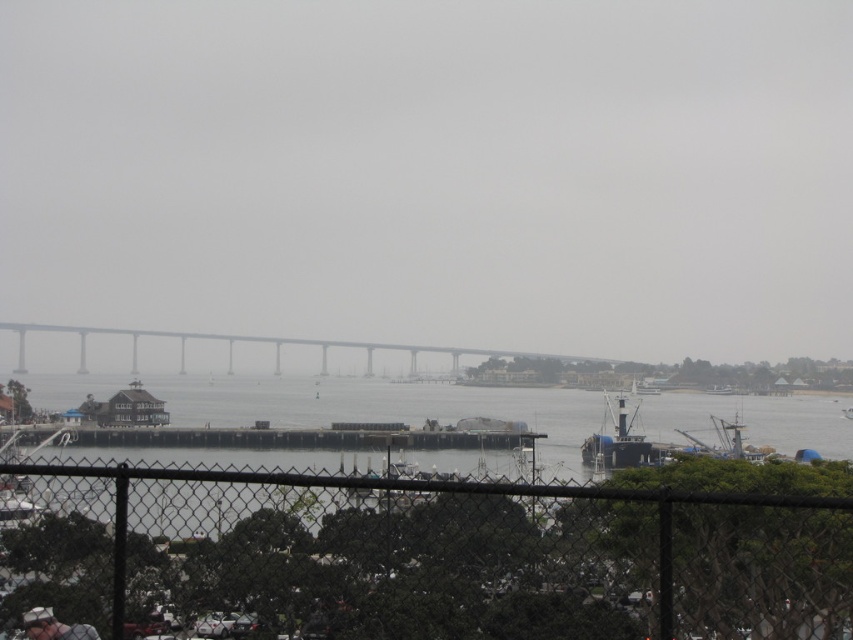
You are a photographer trying to capture the gray concrete bridge at center and the white matte hat at lower left in the same frame. Based on their sizes, which object should you focus on first to ensure both are in focus?

The gray concrete bridge at center is larger than the white matte hat at lower left, so focusing on the gray concrete bridge at center first will help ensure both objects are in focus since it occupies more of the frame.